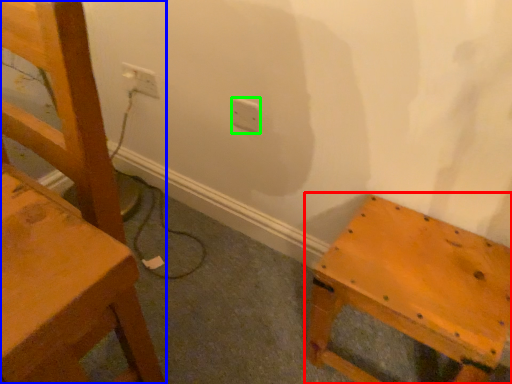
Question: Which is nearer to the furniture (highlighted by a red box)? chair (highlighted by a blue box) or electric outlet (highlighted by a green box).

Choices:
 (A) chair
 (B) electric outlet

Answer: (A)